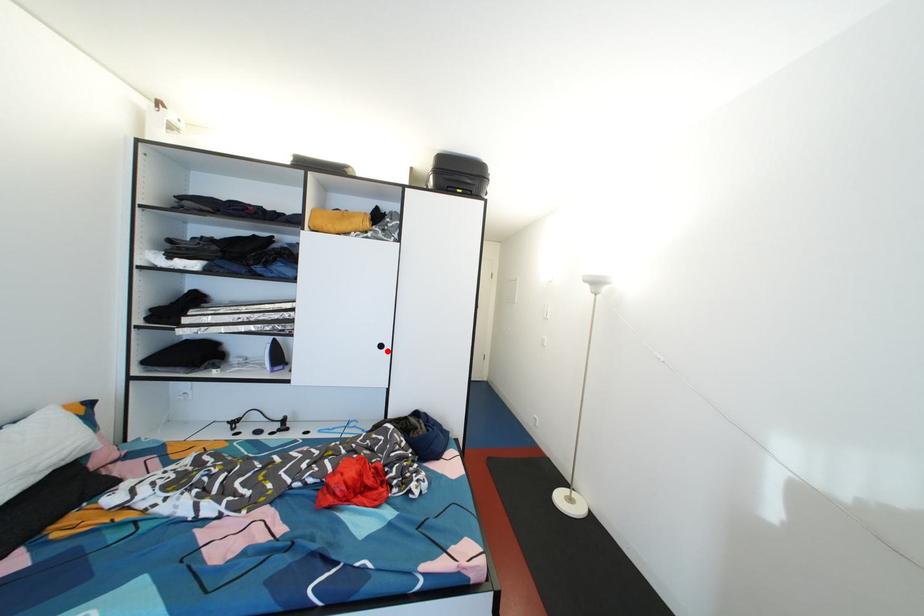
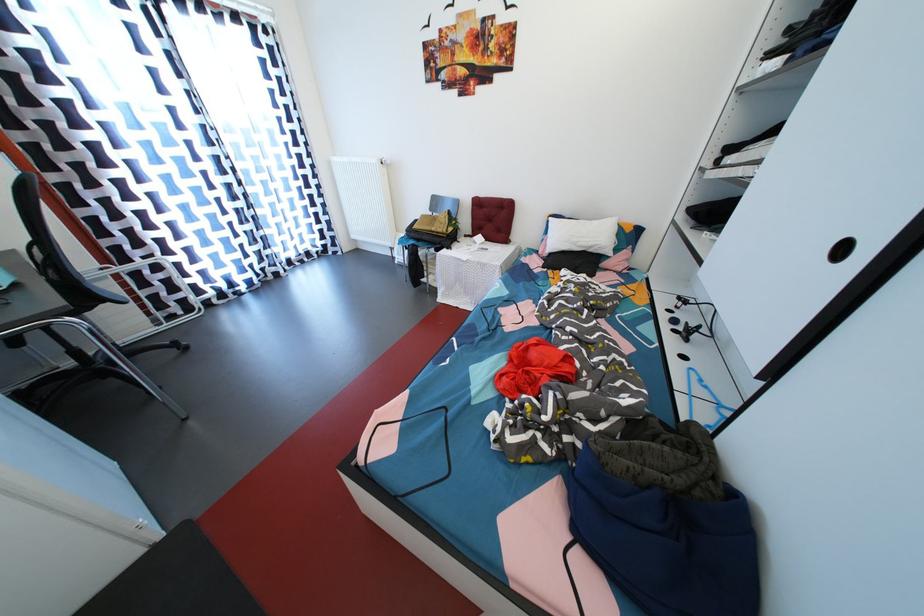
Find the pixel in the second image that matches the highlighted location in the first image.

(848, 254)